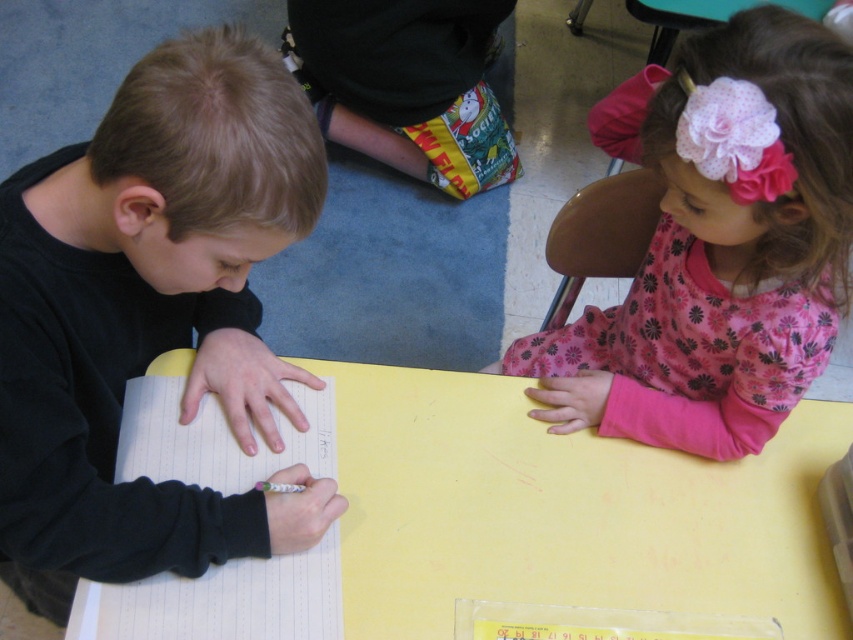
You are a teacher in the classroom. You need to hand out a new worksheet to both the girl in the pink floral dress at upper right and the boy at the yellow table. The worksheet is 20 cm wide. Will the white paper notebook at left be wide enough to hold the worksheet for the girl?

The white paper notebook at left is narrower than the pink floral dress at upper right. Since the worksheet is 20 cm wide, but the notebook is narrower than the dress, we cannot determine if it will fit without knowing the exact width of the notebook.

You are a teacher observing the classroom scene. You need to adjust the desk heights so that both the black matte shirt at left and the pink floral dress at upper right can reach their desks comfortably. Which desk should be raised and which lowered?

The desk for the black matte shirt at left should be lowered since it is much taller than the pink floral dress at upper right. Lowering the desk would allow the taller student to reach comfortably, while raising the desk for the shorter student might be necessary, but according to the description, the black matte shirt at left is taller, so focus on adjusting based on their heights.

You are a teacher observing a classroom scene. You notice the black matte shirt at left and the white paper notebook at left. Which object takes up more space in the image?

The black matte shirt at left is bigger than the white paper notebook at left, so it takes up more space in the image.